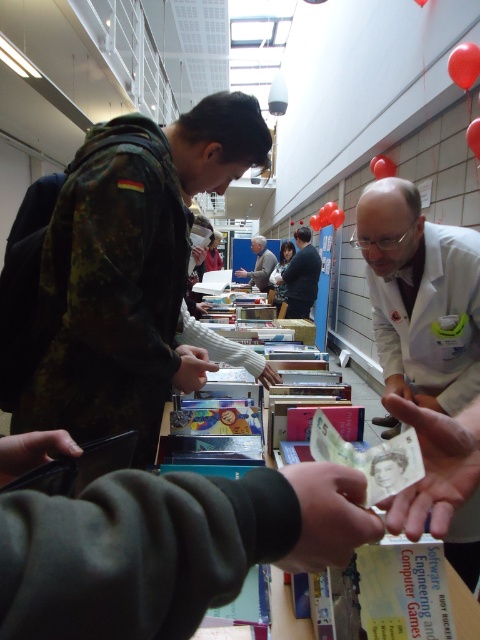
Question: Which of the following is the farthest from the observer?

Choices:
 (A) (264, 272)
 (B) (284, 284)
 (C) (365, 225)
 (D) (311, 260)

Answer: (A)

Question: Does dark gray suit at center appear on the right side of matte black jacket at center?

Choices:
 (A) no
 (B) yes

Answer: (A)

Question: Among these objects, which one is nearest to the camera?

Choices:
 (A) white lab coat at center
 (B) dark gray suit at center

Answer: (A)

Question: Is dark gray suit at center above light brown leather jacket at center?

Choices:
 (A) yes
 (B) no

Answer: (B)

Question: Is white lab coat at center positioned in front of light brown leather jacket at center?

Choices:
 (A) yes
 (B) no

Answer: (A)

Question: Which of the following is the closest to the observer?

Choices:
 (A) (300, 259)
 (B) (439, 352)

Answer: (B)